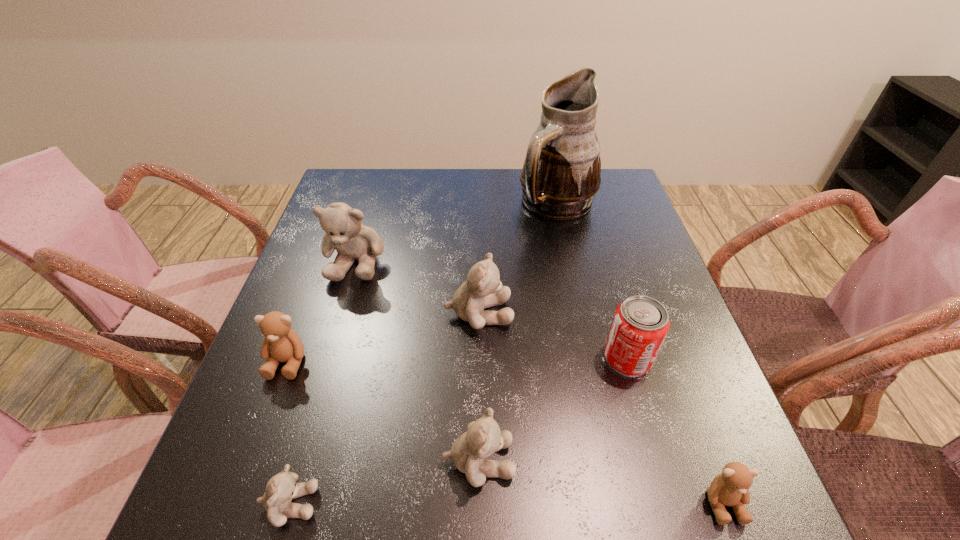
You are a GUI agent. You are given a task and a screenshot of the screen. Output one action in this format:
    pyautogui.click(x=<x>, y=<y>)
    Task: Click on the object that is at the far edge
    
    Given the screenshot: What is the action you would take?
    pyautogui.click(x=561, y=173)

Where is `pitcher that is positioned at the right edge`? pitcher that is positioned at the right edge is located at coordinates (561, 173).

Locate an element on the screen. This screenshot has height=540, width=960. can that is at the right edge is located at coordinates (640, 324).

Find the location of `teddy bear at the right edge`. teddy bear at the right edge is located at coordinates [x=730, y=488].

Find the location of a particular element. object located at the near left corner is located at coordinates (280, 490).

Locate an element on the screen. The image size is (960, 540). object present at the far right corner is located at coordinates (561, 173).

You are a GUI agent. You are given a task and a screenshot of the screen. Output one action in this format:
    pyautogui.click(x=<x>, y=<y>)
    Task: Click on the object that is at the near right corner
    
    Given the screenshot: What is the action you would take?
    pyautogui.click(x=730, y=488)

At what (x,y) coordinates should I click in order to perform the action: click on vacant space at the far edge. Please return your answer as a coordinate pair (x, y). The image size is (960, 540). Looking at the image, I should click on (488, 170).

Where is `free space at the near edge of the desktop`? free space at the near edge of the desktop is located at coordinates (463, 519).

I want to click on free region at the left edge, so click(x=297, y=298).